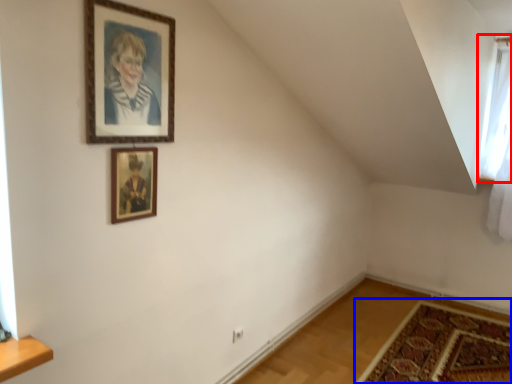
Question: Which object appears closest to the camera in this image, window (highlighted by a red box) or mat (highlighted by a blue box)?

Choices:
 (A) window
 (B) mat

Answer: (B)